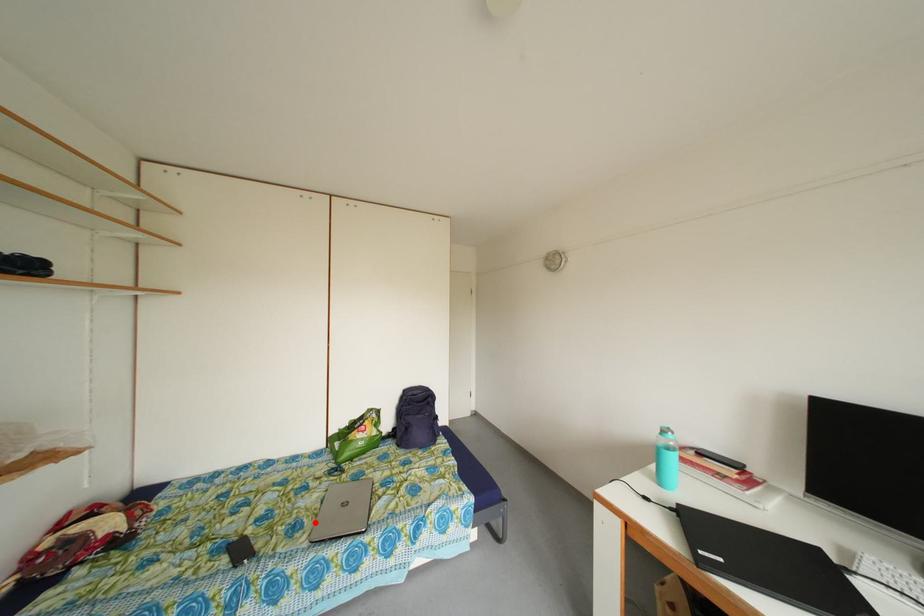
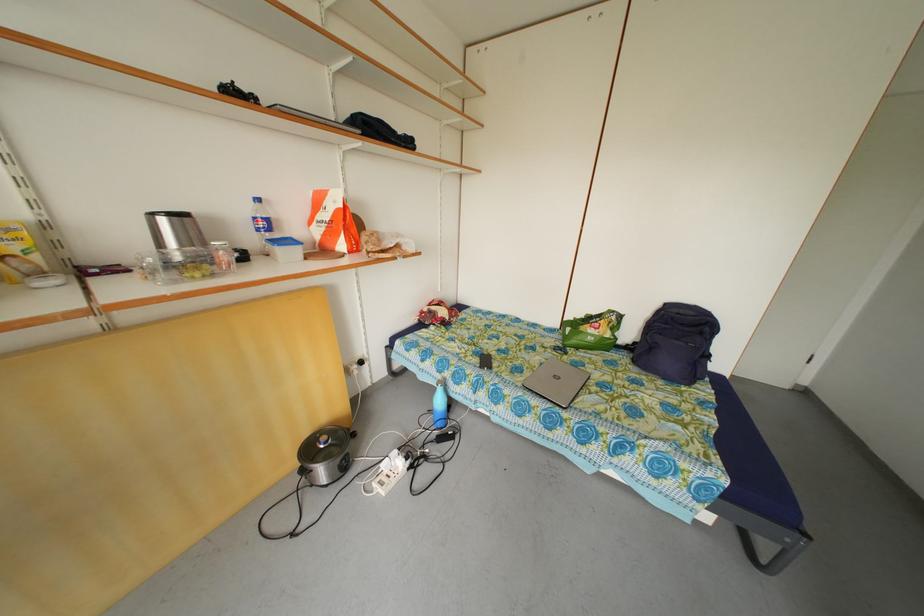
In the second image, find the point that corresponds to the highlighted location in the first image.

(535, 374)